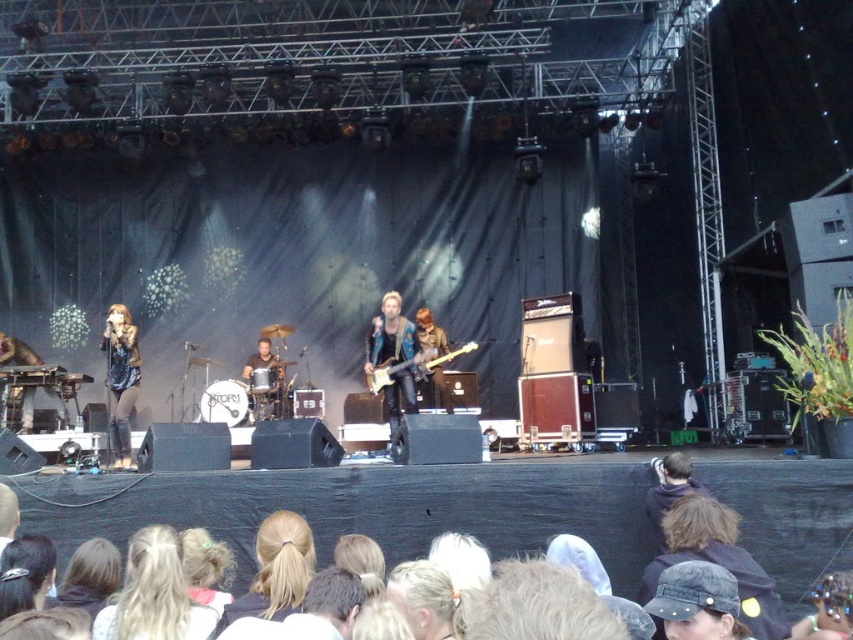
Is blonde hair at center above glossy electric guitar at center?

Actually, blonde hair at center is below glossy electric guitar at center.

Is blonde hair at center positioned in front of glossy electric guitar at center?

Yes, it is in front of glossy electric guitar at center.

This screenshot has width=853, height=640. In order to click on blonde hair at center in this screenshot , I will do `click(276, 572)`.

Is denim cap at lower right below dark brown hair at lower right?

Yes, denim cap at lower right is below dark brown hair at lower right.

In the scene shown: Does denim cap at lower right appear on the left side of dark brown hair at lower right?

Correct, you'll find denim cap at lower right to the left of dark brown hair at lower right.

At what (x,y) coordinates should I click in order to perform the action: click on denim cap at lower right. Please return your answer as a coordinate pair (x, y). Looking at the image, I should click on (717, 557).

Does point (683, 500) come farther from viewer compared to point (390, 371)?

No, it is not.

Between denim cap at lower right and glossy electric guitar at center, which one appears on the left side from the viewer's perspective?

From the viewer's perspective, glossy electric guitar at center appears more on the left side.

What do you see at coordinates (717, 557) in the screenshot? The width and height of the screenshot is (853, 640). I see `denim cap at lower right` at bounding box center [717, 557].

You are a GUI agent. You are given a task and a screenshot of the screen. Output one action in this format:
    pyautogui.click(x=<x>, y=<y>)
    Task: Click on the denim cap at lower right
    Image resolution: width=853 pixels, height=640 pixels.
    Given the screenshot: What is the action you would take?
    pyautogui.click(x=717, y=557)